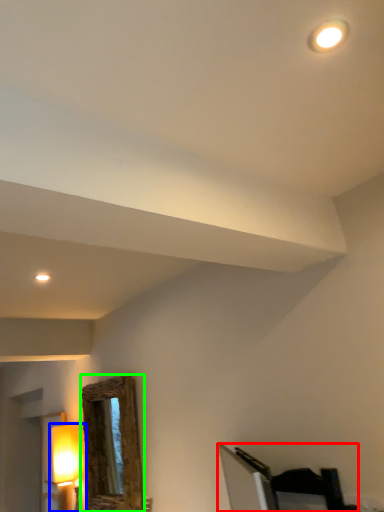
Question: Which is nearer to the furniture (highlighted by a red box)? lamp (highlighted by a blue box) or mirror (highlighted by a green box).

Choices:
 (A) lamp
 (B) mirror

Answer: (B)